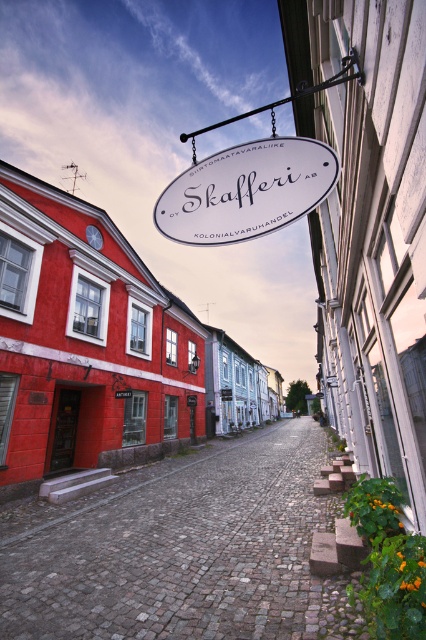
You are standing at the entrance of the ANTIKKI antique shop on the left side of the street. You want to walk directly towards the cobblestone alley at center. What direction should you walk in?

Since the cobblestone alley at center is located at point (183, 548), you should walk forward towards the center of the street to reach it.